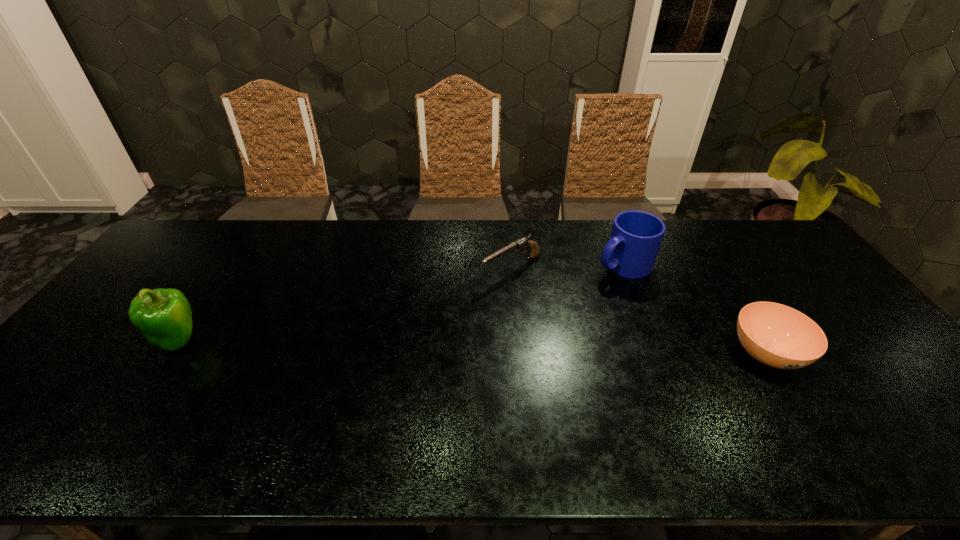
Locate an element on the screen. This screenshot has width=960, height=540. the tallest object is located at coordinates (164, 316).

The width and height of the screenshot is (960, 540). In order to click on the leftmost object in this screenshot , I will do `click(164, 316)`.

Locate an element on the screen. The height and width of the screenshot is (540, 960). the rightmost object is located at coordinates click(x=778, y=336).

You are a GUI agent. You are given a task and a screenshot of the screen. Output one action in this format:
    pyautogui.click(x=<x>, y=<y>)
    Task: Click on the second object from left to right
    Image resolution: width=960 pixels, height=540 pixels.
    Given the screenshot: What is the action you would take?
    pyautogui.click(x=523, y=243)

The image size is (960, 540). Find the location of `mug`. mug is located at coordinates (636, 236).

This screenshot has height=540, width=960. I want to click on the third object from left to right, so click(636, 236).

Locate an element on the screen. free space located 0.170m on the left of the bell pepper is located at coordinates 91,340.

I want to click on blank space located on the front of the rightmost object, so click(806, 418).

Locate an element on the screen. vacant space located aiming along the barrel of the gun is located at coordinates (417, 323).

Locate an element on the screen. vacant space located 0.150m aiming along the barrel of the gun is located at coordinates (450, 303).